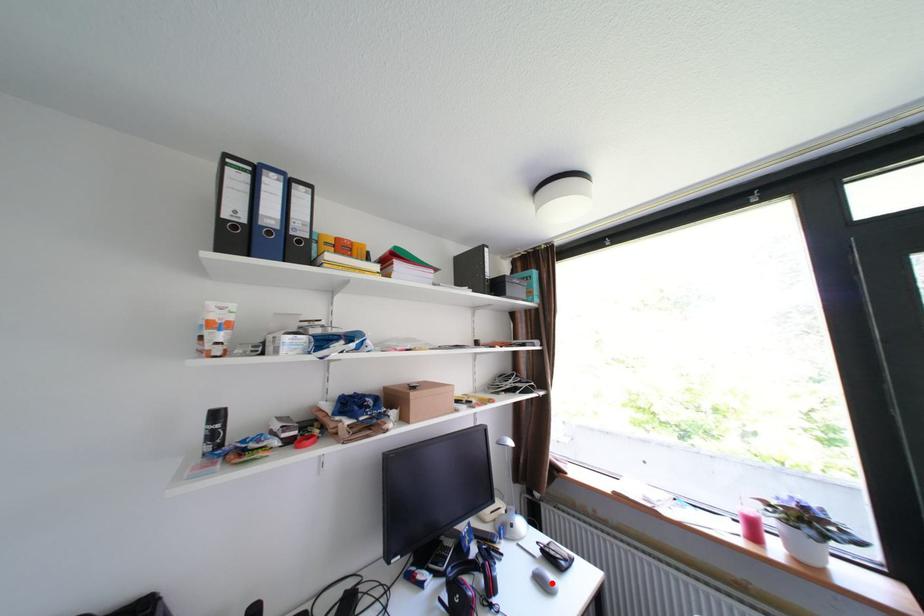
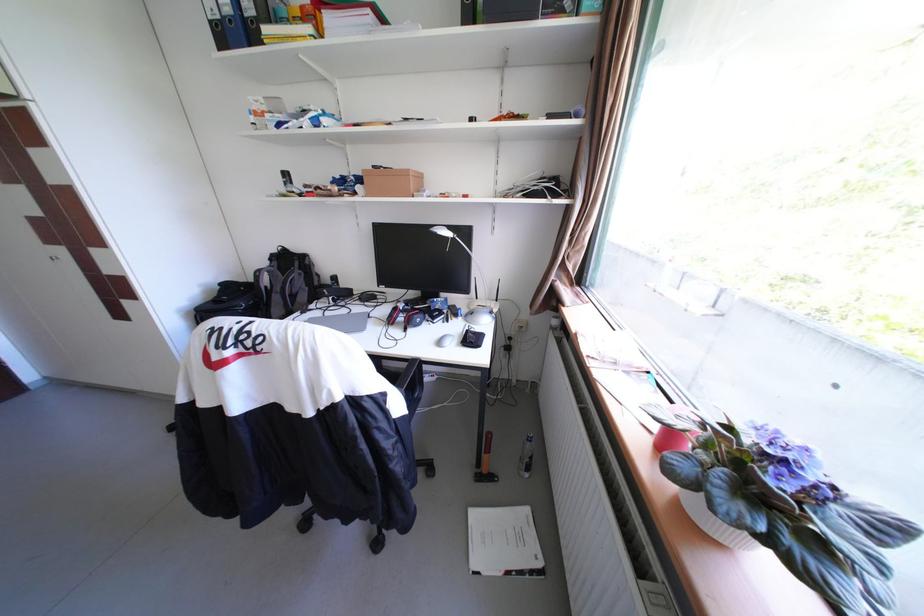
The point at the highlighted location is marked in the first image. Where is the corresponding point in the second image?

(454, 341)